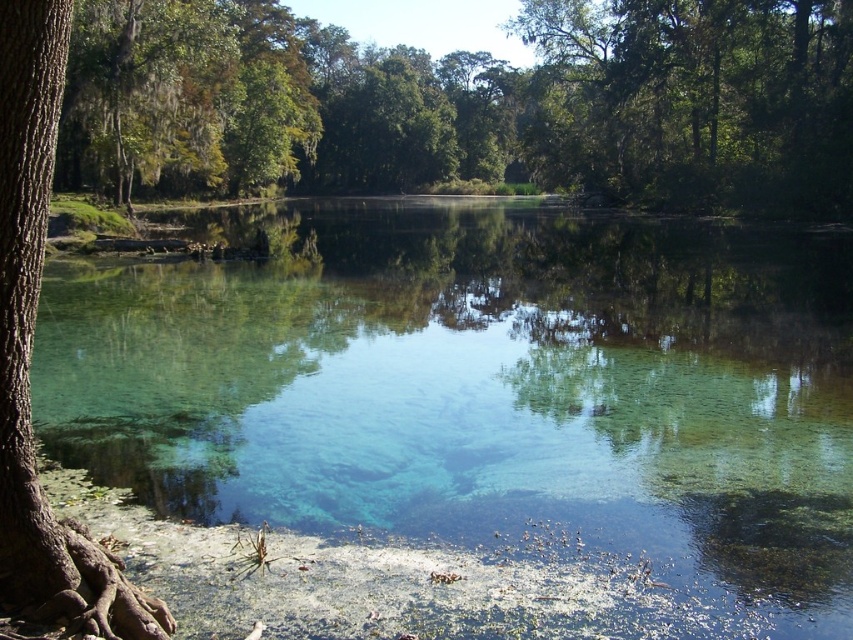
You are standing at the edge of the water and want to reach the green leafy tree at upper right. Which direction should you move to get closer to the tree while staying in the clear water at center?

You should move to the right because the clear water at center is to the left of the green leafy tree at upper right, so moving right in the clear water at center will bring you closer to the tree.